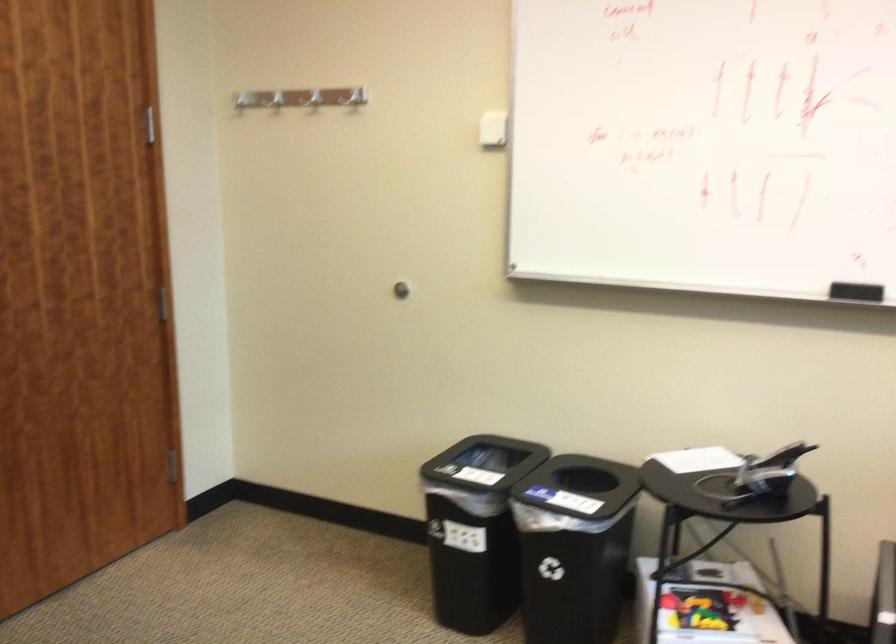
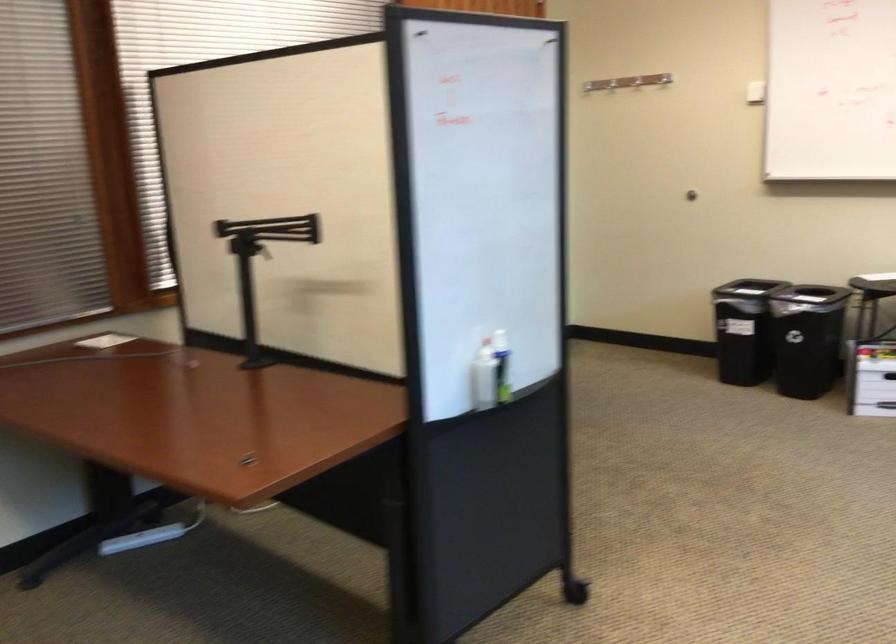
In the second image, find the point that corresponds to point (373, 111) in the first image.

(590, 86)